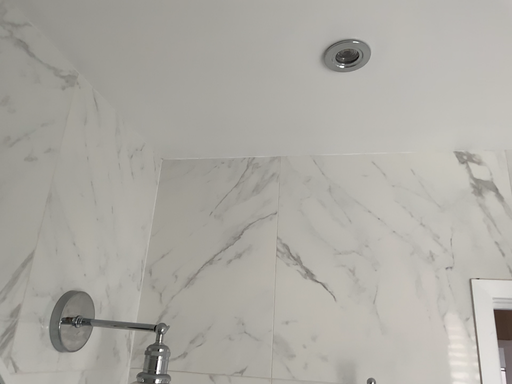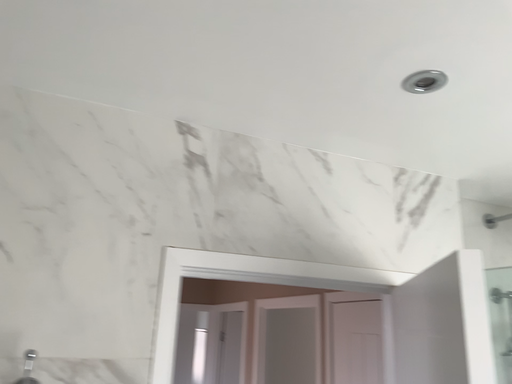
Question: How did the camera likely rotate when shooting the video?

Choices:
 (A) rotated right
 (B) rotated left

Answer: (A)